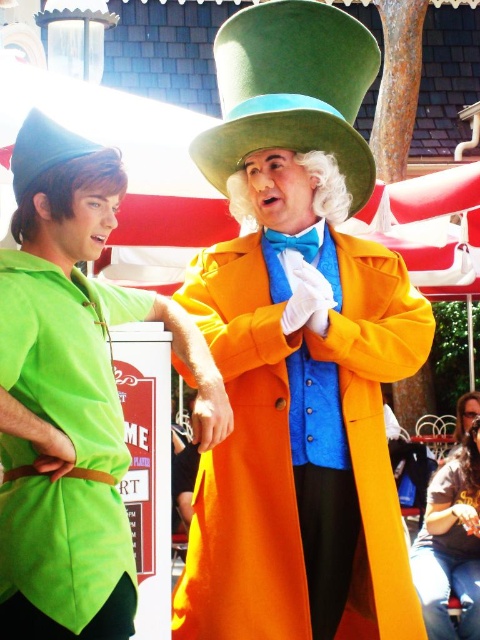
Question: Estimate the real-world distances between objects in this image. Which object is farther from the green felt dress hat at center?

Choices:
 (A) green felt dress hat at left
 (B) smooth brown hair at lower right
 (C) orange matte coat at center

Answer: (B)

Question: Which object is positioned farthest from the green felt dress hat at left?

Choices:
 (A) green felt hat at upper center
 (B) orange matte coat at center

Answer: (B)

Question: Is orange matte coat at center behind green felt dress hat at left?

Choices:
 (A) no
 (B) yes

Answer: (B)

Question: Does green felt dress hat at center have a greater width compared to matte brown hair at lower right?

Choices:
 (A) no
 (B) yes

Answer: (B)

Question: Which point is farther to the camera?

Choices:
 (A) blue satin bow tie at center
 (B) green felt hat at upper center
 (C) orange matte coat at center
 (D) smooth brown hair at lower right

Answer: (D)

Question: Is green felt hat at upper center to the left of matte brown hair at lower right from the viewer's perspective?

Choices:
 (A) yes
 (B) no

Answer: (A)